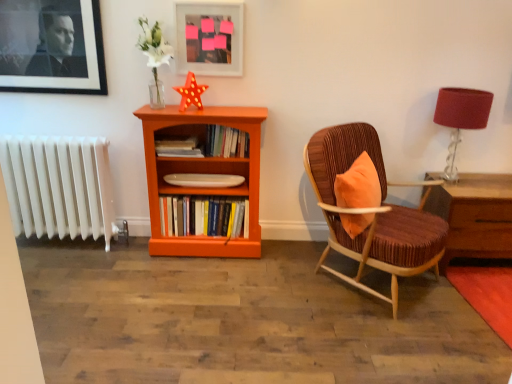
This screenshot has height=384, width=512. What do you see at coordinates (202, 173) in the screenshot?
I see `orange wood bookcase at center` at bounding box center [202, 173].

Describe the element at coordinates (51, 47) in the screenshot. I see `black matte picture frame at upper left, which is the 2th picture frame from right to left` at that location.

This screenshot has height=384, width=512. What are the coordinates of `velvet brown armchair at right` in the screenshot? It's located at (372, 213).

This screenshot has width=512, height=384. I want to click on matte white picture frame at upper center, the first picture frame positioned from the right, so click(x=209, y=39).

The image size is (512, 384). What do you see at coordinates (178, 147) in the screenshot? I see `hardcover books at center, positioned as the 2th book in top-to-bottom order` at bounding box center [178, 147].

The height and width of the screenshot is (384, 512). Describe the element at coordinates (204, 216) in the screenshot. I see `hardcover books at center, the third book from the top` at that location.

This screenshot has width=512, height=384. I want to click on orange wood bookcase at center, so click(x=202, y=173).

Is velvet brown armchair at right placed right next to black matte picture frame at upper left, which is counted as the first picture frame, starting from the left?

velvet brown armchair at right is not next to black matte picture frame at upper left, which is counted as the first picture frame, starting from the left, and they're not touching.

Is the position of velvet brown armchair at right less distant than that of black matte picture frame at upper left, which is counted as the first picture frame, starting from the left?

Yes, the depth of velvet brown armchair at right is less than that of black matte picture frame at upper left, which is counted as the first picture frame, starting from the left.

From the image's perspective, is velvet brown armchair at right located above black matte picture frame at upper left, which is counted as the first picture frame, starting from the left?

No, from the image's perspective, velvet brown armchair at right is not above black matte picture frame at upper left, which is counted as the first picture frame, starting from the left.

Consider the image. From the image's perspective, which one is positioned higher, orange wood bookcase at center or hardcover books at center, acting as the 1th book starting from the top?

hardcover books at center, acting as the 1th book starting from the top, is shown above in the image.

Between orange wood bookcase at center and hardcover books at center, which is the third book from bottom to top, which one appears on the left side from the viewer's perspective?

orange wood bookcase at center is more to the left.

What's the angular difference between orange wood bookcase at center and hardcover books at center, which is the third book from bottom to top,'s facing directions?

The facing directions of orange wood bookcase at center and hardcover books at center, which is the third book from bottom to top, are 8.96e-05 degrees apart.

Between point (150, 198) and point (240, 139), which one is positioned behind?

The point (150, 198) is behind.

How many degrees apart are the facing directions of matte white picture frame at upper center, the first picture frame positioned from the right, and hardcover books at center, acting as the 1th book starting from the top?

0.000172 degrees separate the facing orientations of matte white picture frame at upper center, the first picture frame positioned from the right, and hardcover books at center, acting as the 1th book starting from the top.

Is matte white picture frame at upper center, the first picture frame positioned from the right, oriented away from hardcover books at center, which is the third book from bottom to top?

matte white picture frame at upper center, the first picture frame positioned from the right, does not have its back to hardcover books at center, which is the third book from bottom to top.

From the image's perspective, which object appears higher, matte white picture frame at upper center, placed as the 2th picture frame when sorted from left to right, or hardcover books at center, acting as the 1th book starting from the top?

matte white picture frame at upper center, placed as the 2th picture frame when sorted from left to right, is shown above in the image.

Considering the positions of objects matte white picture frame at upper center, the first picture frame positioned from the right, and hardcover books at center, acting as the 1th book starting from the top, in the image provided, who is behind, matte white picture frame at upper center, the first picture frame positioned from the right, or hardcover books at center, acting as the 1th book starting from the top,?

hardcover books at center, acting as the 1th book starting from the top, is further away from the camera.

Is there a large distance between black matte picture frame at upper left, which is counted as the first picture frame, starting from the left, and orange wood bookcase at center?

That's not correct — black matte picture frame at upper left, which is counted as the first picture frame, starting from the left, is a little close to orange wood bookcase at center.

Is black matte picture frame at upper left, which is counted as the first picture frame, starting from the left, surrounding orange wood bookcase at center?

No, orange wood bookcase at center is located outside of black matte picture frame at upper left, which is counted as the first picture frame, starting from the left.

Considering the sizes of objects black matte picture frame at upper left, which is the 2th picture frame from right to left, and orange wood bookcase at center in the image provided, who is smaller, black matte picture frame at upper left, which is the 2th picture frame from right to left, or orange wood bookcase at center?

With smaller size is black matte picture frame at upper left, which is the 2th picture frame from right to left.

Which of these two, black matte picture frame at upper left, which is the 2th picture frame from right to left, or orange wood bookcase at center, stands taller?

Standing taller between the two is orange wood bookcase at center.

From the image's perspective, who appears lower, velvet brown armchair at right or hardcover books at center, acting as the 1th book starting from the top?

From the image's view, velvet brown armchair at right is below.

Considering the relative positions of velvet brown armchair at right and hardcover books at center, which is the third book from bottom to top, in the image provided, is velvet brown armchair at right to the left of hardcover books at center, which is the third book from bottom to top, from the viewer's perspective?

No.

Is velvet brown armchair at right further to the viewer compared to hardcover books at center, which is the third book from bottom to top?

That is False.

From a real-world perspective, is velvet brown armchair at right physically below hardcover books at center, acting as the 1th book starting from the top?

Yes.

From the picture: Which point is more forward, (49, 26) or (175, 154)?

The point (49, 26) is more forward.

Looking at this image, what's the angular difference between black matte picture frame at upper left, which is the 2th picture frame from right to left, and hardcover books at center, positioned as the 2th book in top-to-bottom order,'s facing directions?

0.00178 degrees.

From a real-world perspective, which object stands above the other?

In real-world perspective, black matte picture frame at upper left, which is counted as the first picture frame, starting from the left, is above.

Can you confirm if black matte picture frame at upper left, which is counted as the first picture frame, starting from the left, is positioned to the left of hardcover books at center, positioned as the 2th book in top-to-bottom order?

Yes, black matte picture frame at upper left, which is counted as the first picture frame, starting from the left, is to the left of hardcover books at center, positioned as the 2th book in top-to-bottom order.

From the image's perspective, relative to matte white picture frame at upper center, the first picture frame positioned from the right, is matte red lampshade at right above or below?

matte red lampshade at right is situated lower than matte white picture frame at upper center, the first picture frame positioned from the right, in the image.

Would you consider matte red lampshade at right to be distant from matte white picture frame at upper center, placed as the 2th picture frame when sorted from left to right?

Absolutely, matte red lampshade at right is distant from matte white picture frame at upper center, placed as the 2th picture frame when sorted from left to right.

Is matte red lampshade at right inside or outside of matte white picture frame at upper center, placed as the 2th picture frame when sorted from left to right?

matte red lampshade at right is located beyond the bounds of matte white picture frame at upper center, placed as the 2th picture frame when sorted from left to right.

Considering the relative sizes of matte red lampshade at right and matte white picture frame at upper center, the first picture frame positioned from the right, in the image provided, is matte red lampshade at right bigger than matte white picture frame at upper center, the first picture frame positioned from the right,?

Correct, matte red lampshade at right is larger in size than matte white picture frame at upper center, the first picture frame positioned from the right.

This screenshot has height=384, width=512. There is a velvet brown armchair at right. What are the coordinates of `the 1st picture frame above it (from the image's perspective)` in the screenshot? It's located at (51, 47).

The image size is (512, 384). Identify the location of book to the right of orange wood bookcase at center. (226, 142).

Based on their spatial positions, is matte red lampshade at right or hardcover books at center, the third book from the top, further from hardcover books at center, the second book in the bottom-to-top sequence?

matte red lampshade at right lies further to hardcover books at center, the second book in the bottom-to-top sequence, than the other object.

Considering their positions, is hardcover books at center, acting as the 1th book starting from the top, positioned closer to hardcover books at center, the second book in the bottom-to-top sequence, than velvet brown armchair at right?

hardcover books at center, acting as the 1th book starting from the top, is closer to hardcover books at center, the second book in the bottom-to-top sequence.

Estimate the real-world distances between objects in this image. Which object is further from hardcover books at center, acting as the 1th book starting from the top, hardcover books at center, the third book from the top, or orange wood bookcase at center?

hardcover books at center, the third book from the top.

When comparing their distances from hardcover books at center, which is the third book from bottom to top, does white plastic radiator at left or hardcover books at center, the second book in the bottom-to-top sequence, seem closer?

Among the two, hardcover books at center, the second book in the bottom-to-top sequence, is located nearer to hardcover books at center, which is the third book from bottom to top.

Considering their positions, is matte white picture frame at upper center, the first picture frame positioned from the right, positioned further to hardcover books at center, positioned as the first book in bottom-to-top order, than hardcover books at center, which is the third book from bottom to top?

matte white picture frame at upper center, the first picture frame positioned from the right, is positioned further to the anchor hardcover books at center, positioned as the first book in bottom-to-top order.

Estimate the real-world distances between objects in this image. Which object is closer to black matte picture frame at upper left, which is the 2th picture frame from right to left, matte red lampshade at right or matte white picture frame at upper center, the first picture frame positioned from the right?

Among the two, matte white picture frame at upper center, the first picture frame positioned from the right, is located nearer to black matte picture frame at upper left, which is the 2th picture frame from right to left.

Which object lies nearer to the anchor point hardcover books at center, positioned as the first book in bottom-to-top order, velvet brown armchair at right or white plastic radiator at left?

white plastic radiator at left is positioned closer to the anchor hardcover books at center, positioned as the first book in bottom-to-top order.

Considering their positions, is hardcover books at center, the third book from the top, positioned further to white plastic radiator at left than black matte picture frame at upper left, which is counted as the first picture frame, starting from the left?

hardcover books at center, the third book from the top.

I want to click on bookcase that lies between hardcover books at center, acting as the 1th book starting from the top, and hardcover books at center, the third book from the top, from top to bottom, so click(202, 173).

Where is `bookcase that lies between hardcover books at center, positioned as the 2th book in top-to-bottom order, and hardcover books at center, positioned as the first book in bottom-to-top order, from top to bottom`? The image size is (512, 384). bookcase that lies between hardcover books at center, positioned as the 2th book in top-to-bottom order, and hardcover books at center, positioned as the first book in bottom-to-top order, from top to bottom is located at coordinates (202, 173).

You are a GUI agent. You are given a task and a screenshot of the screen. Output one action in this format:
    pyautogui.click(x=<x>, y=<y>)
    Task: Click on the bookcase situated between white plastic radiator at left and hardcover books at center, acting as the 1th book starting from the top, from left to right
    
    Given the screenshot: What is the action you would take?
    pyautogui.click(x=202, y=173)

The image size is (512, 384). I want to click on picture frame located between orange wood bookcase at center and velvet brown armchair at right in the left-right direction, so click(x=209, y=39).